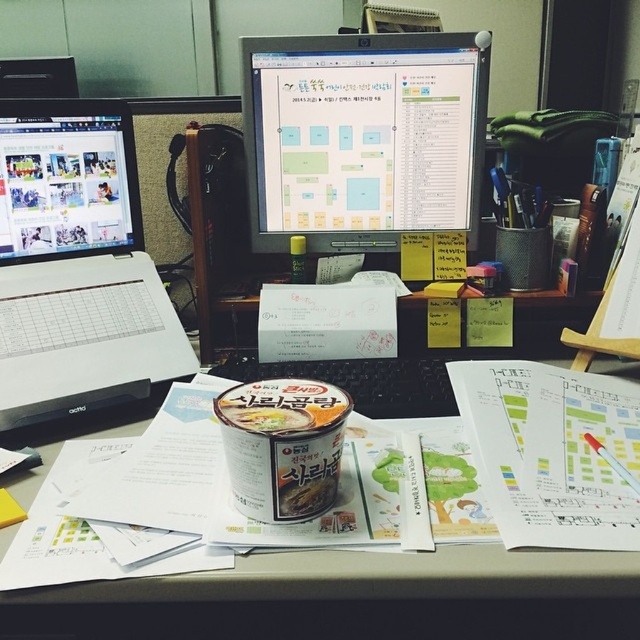
Is matte black laptop at left in front of matte plastic cup at center?

No, matte black laptop at left is behind matte plastic cup at center.

Between matte black laptop at left and matte plastic cup at center, which one appears on the left side from the viewer's perspective?

Positioned to the left is matte black laptop at left.

Find the location of a particular element. This screenshot has height=640, width=640. matte black laptop at left is located at coordinates (67, 179).

Find the location of `matte black laptop at left`. matte black laptop at left is located at coordinates (67, 179).

Is white plastic laptop at left further to the viewer compared to matte black laptop at left?

No, it is in front of matte black laptop at left.

Between white plastic laptop at left and matte black laptop at left, which one is positioned higher?

matte black laptop at left is above.

At what (x,y) coordinates should I click in order to perform the action: click on white plastic laptop at left. Please return your answer as a coordinate pair (x, y). The image size is (640, 640). Looking at the image, I should click on (76, 266).

Identify the location of white plastic laptop at left. (76, 266).

Can you confirm if white plastic laptop at left is taller than matte plastic cup at center?

Yes.

Which is behind, point (72, 150) or point (324, 456)?

Positioned behind is point (72, 150).

Identify the location of white plastic laptop at left. (76, 266).